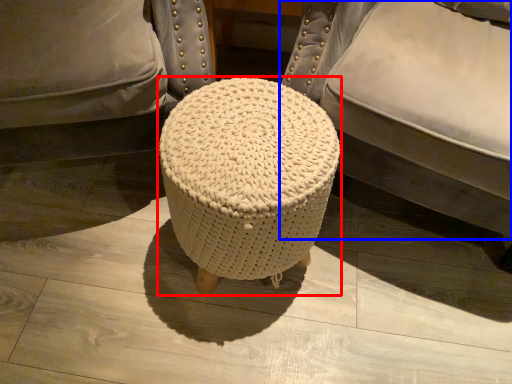
Question: Which object appears farthest to the camera in this image, stool (highlighted by a red box) or furniture (highlighted by a blue box)?

Choices:
 (A) stool
 (B) furniture

Answer: (A)